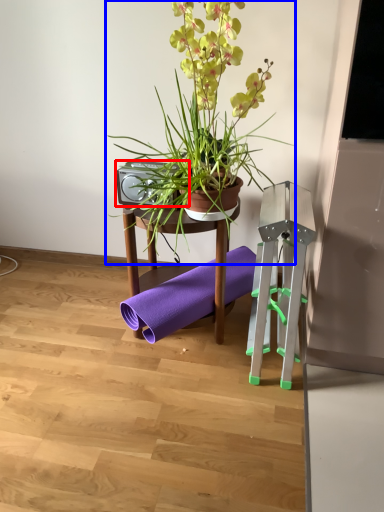
Question: Among these objects, which one is nearest to the camera, speaker (highlighted by a red box) or houseplant (highlighted by a blue box)?

Choices:
 (A) speaker
 (B) houseplant

Answer: (B)